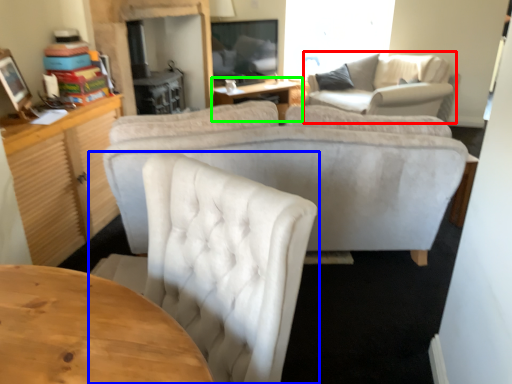
Question: Based on their relative distances, which object is nearer to couch (highlighted by a red box)? Choose from chair (highlighted by a blue box) and table (highlighted by a green box).

Choices:
 (A) chair
 (B) table

Answer: (B)